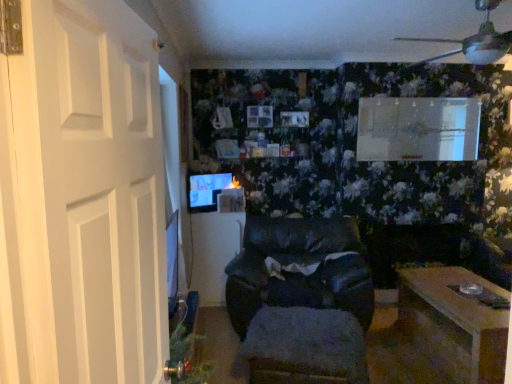
Question: Considering the positions of black leather chair at center and white matte door at left in the image, is black leather chair at center wider or thinner than white matte door at left?

Choices:
 (A) thin
 (B) wide

Answer: (B)

Question: Considering the relative positions of black leather chair at center and white matte door at left in the image provided, is black leather chair at center to the left or to the right of white matte door at left?

Choices:
 (A) right
 (B) left

Answer: (A)

Question: Based on their relative distances, which object is nearer to the fuzzy fabric footrest at center?

Choices:
 (A) wooden table at lower right, which appears as the second table when viewed from the left
 (B) black leather chair at center
 (C) wooden coffee table at center, positioned as the 2th table in right-to-left order
 (D) white matte door at left
 (E) matte black monitor at center

Answer: (B)

Question: Considering the real-world distances, which object is farthest from the wooden table at lower right, the 1th table viewed from the right?

Choices:
 (A) black leather chair at center
 (B) wooden coffee table at center, which is the 2th table from front to back
 (C) white matte door at left
 (D) fuzzy fabric footrest at center
 (E) matte black monitor at center

Answer: (C)